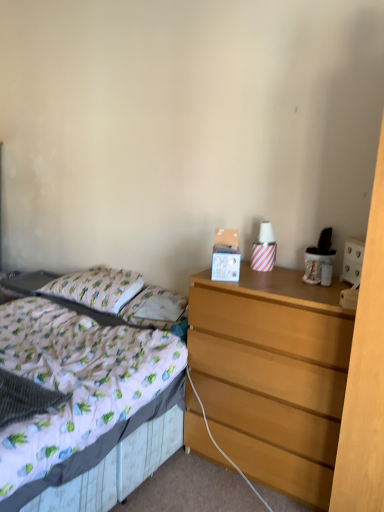
Question: In the image, is white fabric bed at left positioned in front of or behind wooden chest of drawers at right?

Choices:
 (A) front
 (B) behind

Answer: (A)

Question: Looking at the image, does white fabric bed at left seem bigger or smaller compared to wooden chest of drawers at right?

Choices:
 (A) small
 (B) big

Answer: (B)

Question: Which is nearer to the wooden chest of drawers at right?

Choices:
 (A) cotton/cotton-like pillow at left, the second pillow viewed from the right
 (B) white fabric pillow at center, marked as the 2th pillow in a left-to-right arrangement
 (C) white fabric bed at left

Answer: (C)

Question: Which object is positioned farthest from the white fabric bed at left?

Choices:
 (A) cotton/cotton-like pillow at left, the second pillow viewed from the right
 (B) wooden chest of drawers at right
 (C) white fabric pillow at center, marked as the 2th pillow in a left-to-right arrangement

Answer: (A)